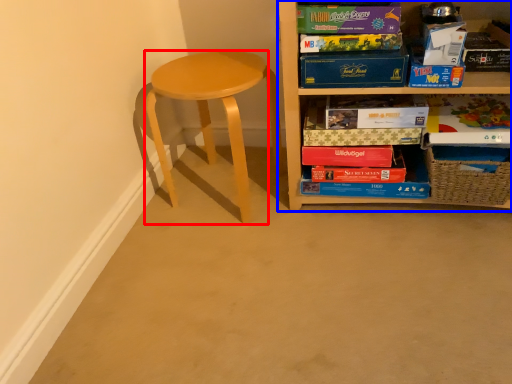
Question: Among these objects, which one is farthest to the camera, stool (highlighted by a red box) or shelf (highlighted by a blue box)?

Choices:
 (A) stool
 (B) shelf

Answer: (A)